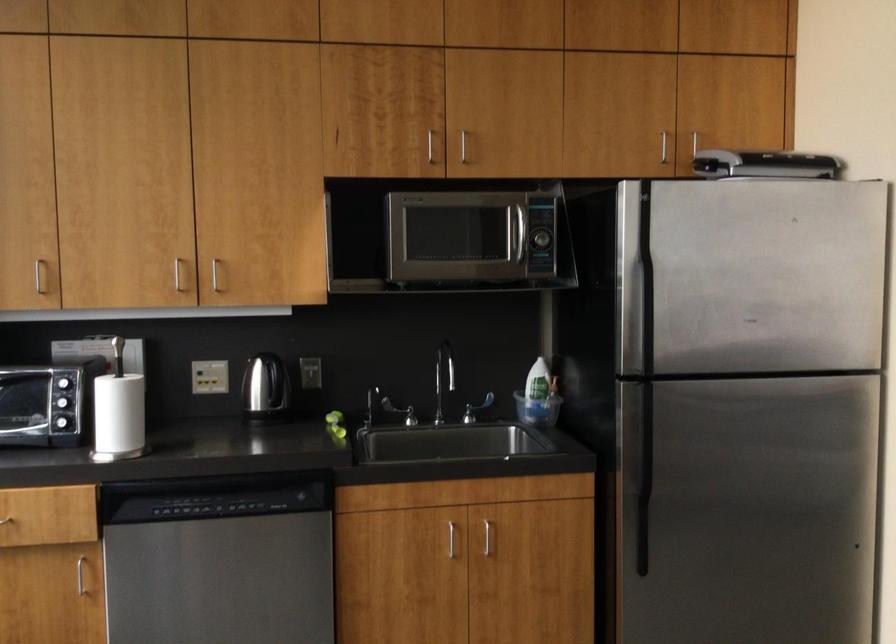
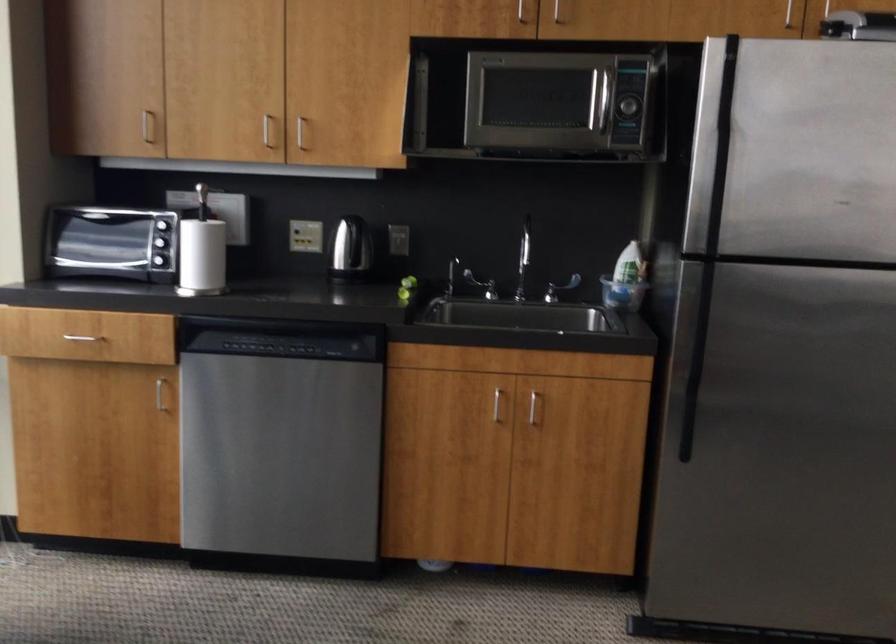
Where in the second image is the point corresponding to (540,410) from the first image?

(622, 294)